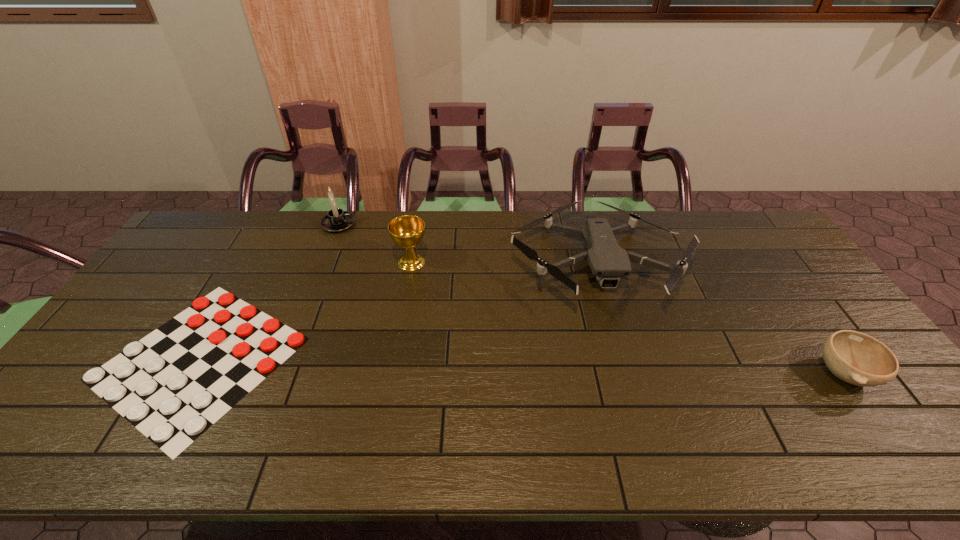
In order to click on vacant space that's between the checkerboard and the candle holder in this screenshot , I will do `click(269, 292)`.

This screenshot has width=960, height=540. I want to click on free space between the chalice and the candle holder, so click(x=375, y=244).

You are a GUI agent. You are given a task and a screenshot of the screen. Output one action in this format:
    pyautogui.click(x=<x>, y=<y>)
    Task: Click on the empty location between the third shortest object and the shortest object
    
    Given the screenshot: What is the action you would take?
    pyautogui.click(x=398, y=311)

The height and width of the screenshot is (540, 960). Find the location of `object that is the third closest to the checkerboard`. object that is the third closest to the checkerboard is located at coordinates (607, 260).

Point out which object is positioned as the second nearest to the candle holder. Please provide its 2D coordinates. Your answer should be formatted as a tuple, i.e. [(x, y)], where the tuple contains the x and y coordinates of a point satisfying the conditions above.

[(172, 385)]

You are a GUI agent. You are given a task and a screenshot of the screen. Output one action in this format:
    pyautogui.click(x=<x>, y=<y>)
    Task: Click on the free region that satisfies the following two spatial constraints: 1. with a handle on the side of the bowl; 2. on the left side of the candle holder
    
    Given the screenshot: What is the action you would take?
    pyautogui.click(x=280, y=373)

Find the location of a particular element. Image resolution: width=960 pixels, height=540 pixels. vacant space that satisfies the following two spatial constraints: 1. with a handle on the side of the chalice; 2. on the right side of the candle holder is located at coordinates [x=324, y=262].

Identify the location of vacant space that satisfies the following two spatial constraints: 1. with a handle on the side of the third object from right to left; 2. on the right side of the candle holder. Image resolution: width=960 pixels, height=540 pixels. (324, 262).

At what (x,y) coordinates should I click in order to perform the action: click on vacant space that satisfies the following two spatial constraints: 1. with a handle on the side of the candle holder; 2. on the right side of the third object from right to left. Please return your answer as a coordinate pair (x, y). Image resolution: width=960 pixels, height=540 pixels. Looking at the image, I should click on (324, 262).

Identify the location of vacant space that satisfies the following two spatial constraints: 1. on the back side of the chalice; 2. with a handle on the side of the candle holder. (418, 225).